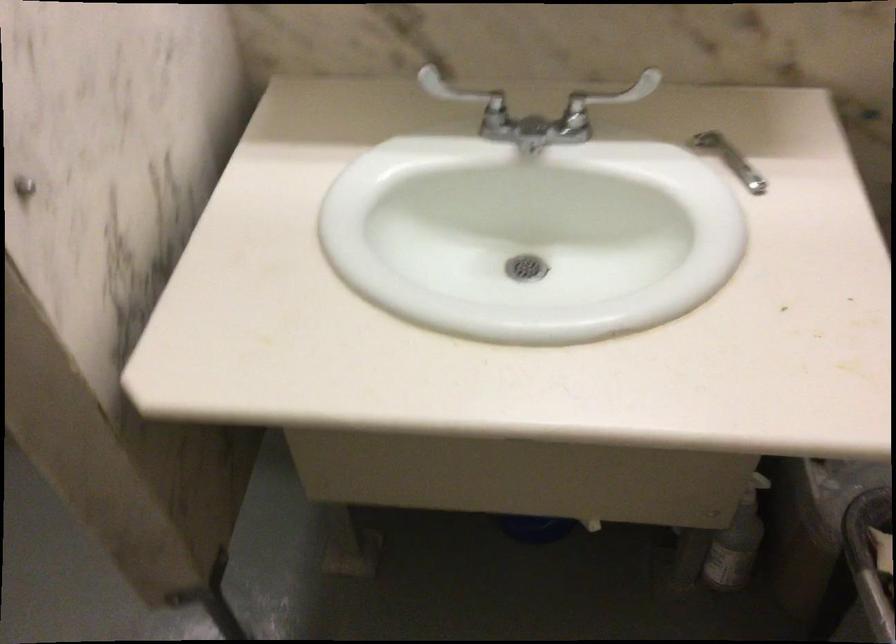
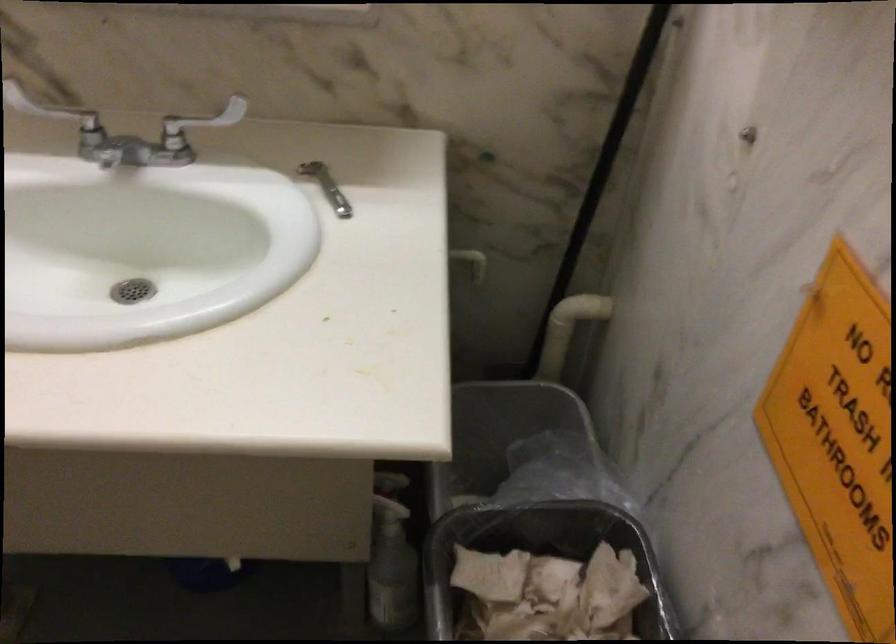
Question: The camera is either moving clockwise (left) or counter-clockwise (right) around the object. The first image is from the beginning of the video and the second image is from the end. Is the camera moving left or right when shooting the video?

Choices:
 (A) Left
 (B) Right

Answer: (A)